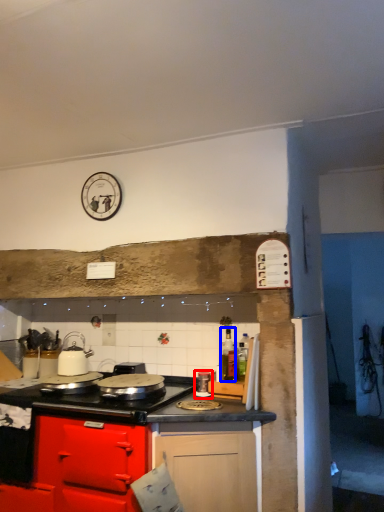
Question: Which object appears closest to the camera in this image, kitchen appliance (highlighted by a red box) or bottle (highlighted by a blue box)?

Choices:
 (A) kitchen appliance
 (B) bottle

Answer: (A)